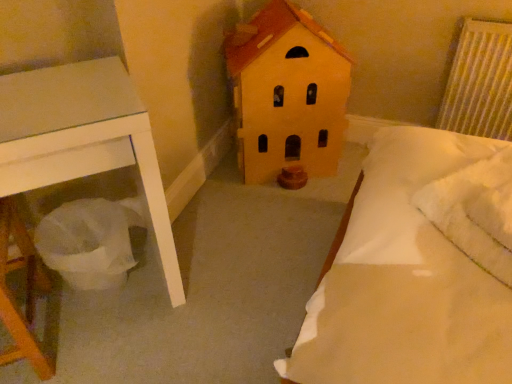
The height and width of the screenshot is (384, 512). Find the location of `white fluffy pillow at upper right`. white fluffy pillow at upper right is located at coordinates (475, 212).

Is white textured radiator at upper right completely or partially outside of matte yellow house at center?

white textured radiator at upper right is positioned outside matte yellow house at center.

Is point (439, 108) more distant than point (308, 108)?

Yes.

Which is in front, white textured radiator at upper right or matte yellow house at center?

Positioned in front is matte yellow house at center.

From a real-world perspective, who is located higher, white textured radiator at upper right or matte yellow house at center?

From a 3D spatial view, white textured radiator at upper right is above.

Is white fluffy pillow at upper right facing away from white textured radiator at upper right?

No, white textured radiator at upper right is not at the back of white fluffy pillow at upper right.

Considering the sizes of objects white fluffy pillow at upper right and white textured radiator at upper right in the image provided, who is wider, white fluffy pillow at upper right or white textured radiator at upper right?

white fluffy pillow at upper right.

Consider the image. Is white fluffy pillow at upper right with white textured radiator at upper right?

No, white fluffy pillow at upper right is not in contact with white textured radiator at upper right.

Considering the positions of objects white fluffy pillow at upper right and white textured radiator at upper right in the image provided, who is more to the left, white fluffy pillow at upper right or white textured radiator at upper right?

white fluffy pillow at upper right.

Does white textured radiator at upper right have a larger size compared to white fluffy pillow at upper right?

Indeed, white textured radiator at upper right has a larger size compared to white fluffy pillow at upper right.

From the image's perspective, which is above, white textured radiator at upper right or white fluffy pillow at upper right?

white textured radiator at upper right appears higher in the image.

The height and width of the screenshot is (384, 512). Find the location of `radiator that appears below the white fluffy pillow at upper right (from a real-world perspective)`. radiator that appears below the white fluffy pillow at upper right (from a real-world perspective) is located at coordinates (479, 82).

Is matte yellow house at center inside or outside of white textured radiator at upper right?

matte yellow house at center is spatially situated outside white textured radiator at upper right.

Is matte yellow house at center touching white textured radiator at upper right?

No, matte yellow house at center is not touching white textured radiator at upper right.

From a real-world perspective, is matte yellow house at center over white textured radiator at upper right?

Incorrect, from a real-world perspective, matte yellow house at center is lower than white textured radiator at upper right.

Is matte yellow house at center at the left side of white fluffy pillow at upper right?

Yes.

Is matte yellow house at center oriented away from white fluffy pillow at upper right?

No.

Which point is more distant from viewer, (255, 78) or (507, 272)?

The point (255, 78) is behind.

Would you say matte yellow house at center is a long distance from white fluffy pillow at upper right?

They are positioned close to each other.

Find the location of a particular element. The image size is (512, 384). toy lying above the white fluffy pillow at upper right (from the image's perspective) is located at coordinates (287, 93).

Is white fluffy pillow at upper right oriented towards matte yellow house at center?

No, white fluffy pillow at upper right is not aimed at matte yellow house at center.

Considering their positions, is white fluffy pillow at upper right located in front of or behind matte yellow house at center?

white fluffy pillow at upper right is positioned closer to the viewer than matte yellow house at center.

Is point (457, 210) positioned behind point (256, 27)?

No, (457, 210) is closer to viewer.

Identify the location of toy in front of the white textured radiator at upper right. (287, 93).

Identify the location of pillow below the white textured radiator at upper right (from the image's perspective). (475, 212).

Which object lies nearer to the anchor point matte yellow house at center, white textured radiator at upper right or white fluffy pillow at upper right?

white textured radiator at upper right is positioned closer to the anchor matte yellow house at center.

Estimate the real-world distances between objects in this image. Which object is further from matte yellow house at center, white fluffy pillow at upper right or white textured radiator at upper right?

white fluffy pillow at upper right is further to matte yellow house at center.

Based on their spatial positions, is matte yellow house at center or white fluffy pillow at upper right closer to white textured radiator at upper right?

Based on the image, matte yellow house at center appears to be nearer to white textured radiator at upper right.

When comparing their distances from white fluffy pillow at upper right, does white textured radiator at upper right or matte yellow house at center seem closer?

matte yellow house at center.

Looking at the image, which one is located closer to white textured radiator at upper right, white fluffy pillow at upper right or matte yellow house at center?

matte yellow house at center.

Considering their positions, is matte yellow house at center positioned further to white fluffy pillow at upper right than white textured radiator at upper right?

white textured radiator at upper right is positioned further to the anchor white fluffy pillow at upper right.

Where is `pillow between matte yellow house at center and white textured radiator at upper right in the horizontal direction`? pillow between matte yellow house at center and white textured radiator at upper right in the horizontal direction is located at coordinates (475, 212).